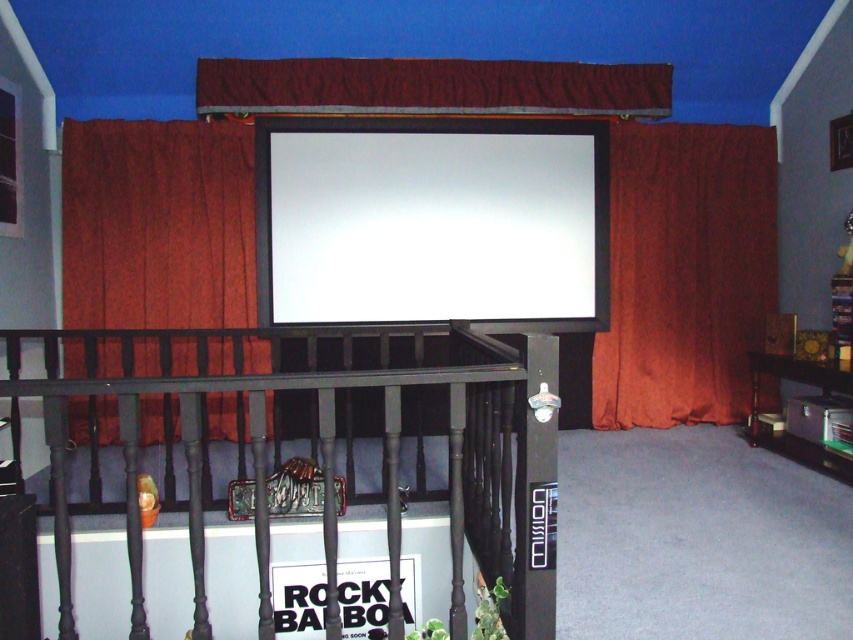
Question: Can you confirm if white glossy projection screen at upper center is positioned above velvet burgundy curtain at upper center?

Choices:
 (A) no
 (B) yes

Answer: (A)

Question: Which is nearer to the velvet burgundy curtain at upper center?

Choices:
 (A) white glossy projection screen at upper center
 (B) burgundy velvet curtain at right
 (C) crimson velvet curtain at left

Answer: (A)

Question: Which point is farther from the camera taking this photo?

Choices:
 (A) (151, 122)
 (B) (750, 323)
 (C) (636, 80)
 (D) (424, 198)

Answer: (B)

Question: Is white glossy projection screen at upper center positioned before velvet burgundy curtain at upper center?

Choices:
 (A) yes
 (B) no

Answer: (B)

Question: Estimate the real-world distances between objects in this image. Which object is farther from the white glossy projection screen at upper center?

Choices:
 (A) crimson velvet curtain at left
 (B) black wrought iron balustrade at lower center

Answer: (B)

Question: Is black wrought iron balustrade at lower center to the right of velvet burgundy curtain at upper center from the viewer's perspective?

Choices:
 (A) no
 (B) yes

Answer: (A)